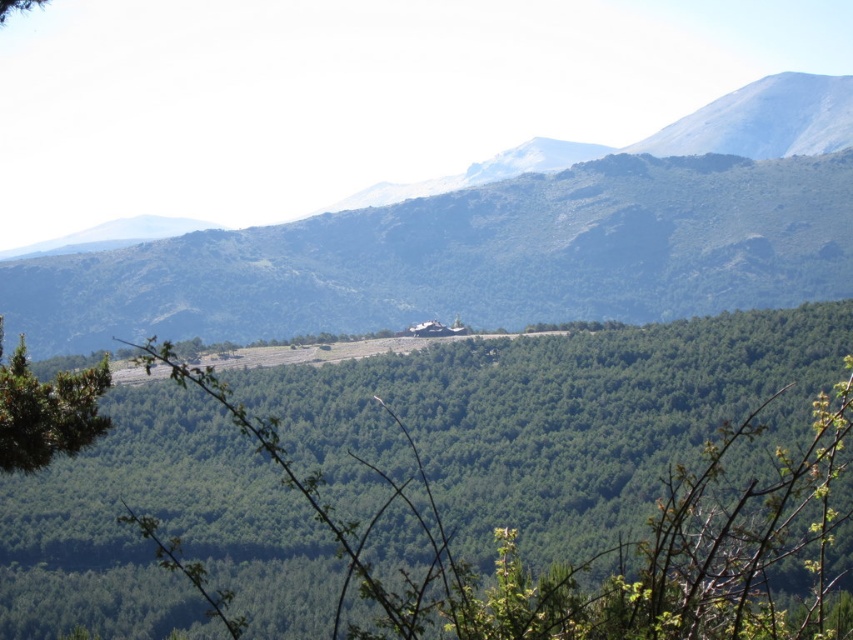
You are a hiker who wants to take a photo of the green leafy tree at center. To avoid blocking the view, you need to move to the right side of the green leafy tree at lower left. Is this possible?

Yes, since the green leafy tree at lower left is positioned on the left side of the green leafy tree at center, moving to the right side of the green leafy tree at lower left would allow you to have an unobstructed view of the green leafy tree at center.

You are a hiker who wants to take a photo of the green matte mountain at center from a specific location. The camera you are using has a built in GPS. What coordinates should you input into the camera to ensure the mountain is centered in your photo?

You should input coordinates point (502,240) into the camera to ensure the green matte mountain at center is centered in your photo.

You are planning to build a hiking trail that goes from the green leafy tree at center to the green matte mountain at center. Considering their heights, which object will require more elevation gain for hikers to reach its base?

The green matte mountain at center is taller than the green leafy tree at center, so hikers will need more elevation gain to reach the base of the green matte mountain at center.